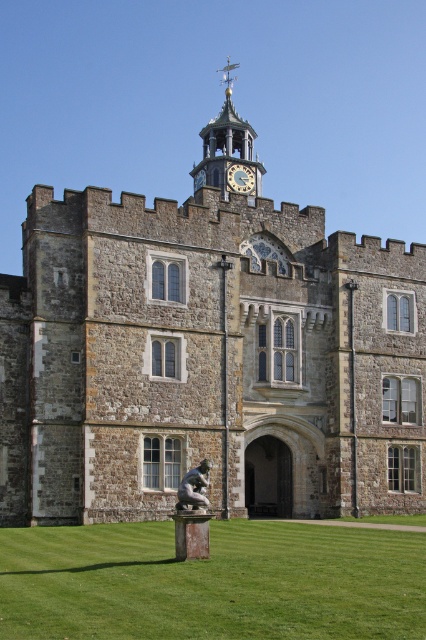
Does stone clock tower at upper center appear under gold metallic clock at upper center?

Actually, stone clock tower at upper center is above gold metallic clock at upper center.

Between stone clock tower at upper center and gold metallic clock at upper center, which one appears on the right side from the viewer's perspective?

gold metallic clock at upper center

From the picture: Who is more distant from viewer, (204, 148) or (233, 179)?

Positioned behind is point (204, 148).

Identify the location of stone clock tower at upper center. (229, 150).

Can you confirm if brown stone castle at center is bigger than bronze statue at center?

Yes.

Which of these two, brown stone castle at center or bronze statue at center, stands shorter?

With less height is bronze statue at center.

Describe the element at coordinates (207, 355) in the screenshot. I see `brown stone castle at center` at that location.

This screenshot has width=426, height=640. In order to click on brown stone castle at center in this screenshot , I will do `click(207, 355)`.

Can you confirm if brown stone castle at center is shorter than green grass at lower center?

No.

Between brown stone castle at center and green grass at lower center, which one has more height?

With more height is brown stone castle at center.

Who is more forward, [365,417] or [2,616]?

Point [2,616]

The width and height of the screenshot is (426, 640). What are the coordinates of `brown stone castle at center` in the screenshot? It's located at (207, 355).